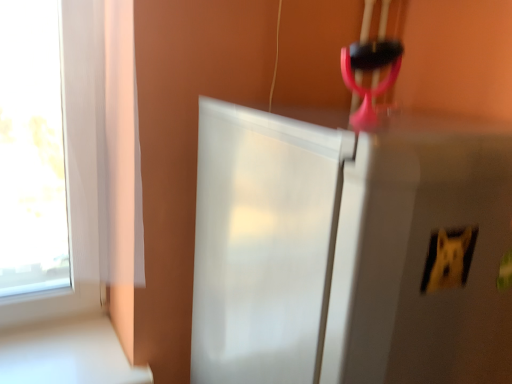
What do you see at coordinates (348, 253) in the screenshot? I see `satin white refrigerator at center` at bounding box center [348, 253].

Where is `satin white refrigerator at center`? This screenshot has height=384, width=512. satin white refrigerator at center is located at coordinates (348, 253).

The width and height of the screenshot is (512, 384). Find the location of `satin white refrigerator at center`. satin white refrigerator at center is located at coordinates (348, 253).